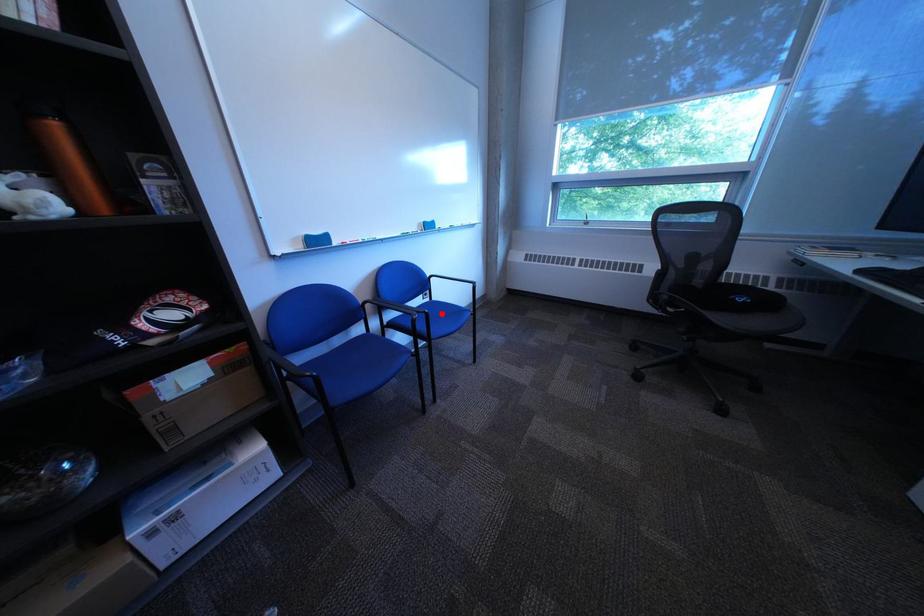
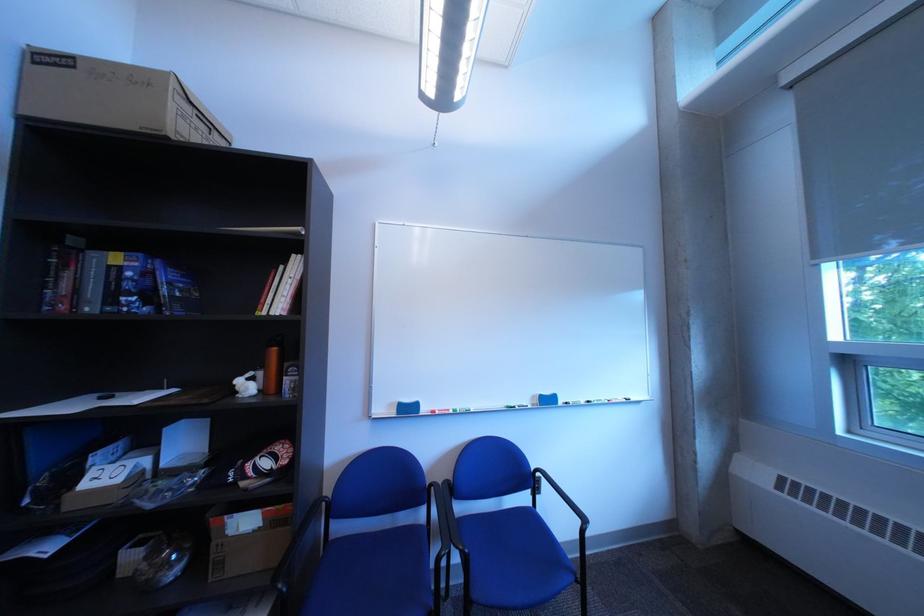
The point at the highlighted location is marked in the first image. Where is the corresponding point in the second image?

(482, 553)